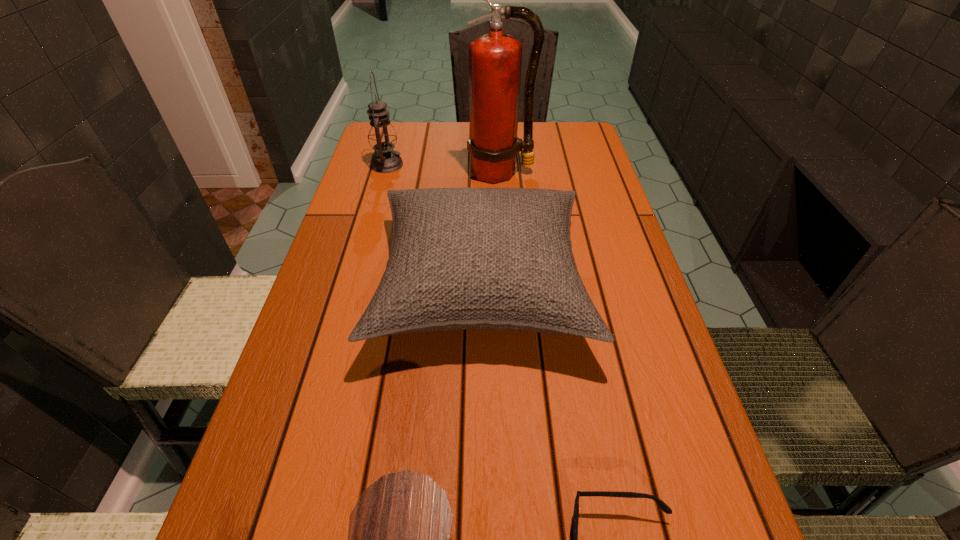
I want to click on fire extinguisher, so click(x=495, y=59).

Where is `oil lamp`? oil lamp is located at coordinates (381, 135).

This screenshot has width=960, height=540. What are the coordinates of `the fourth shortest object` in the screenshot? It's located at (381, 135).

Identify the location of the third farthest object. The image size is (960, 540). (461, 258).

The width and height of the screenshot is (960, 540). Find the location of `free space located 0.050m at the nozzle of the tallest object`. free space located 0.050m at the nozzle of the tallest object is located at coordinates (502, 197).

You are a GUI agent. You are given a task and a screenshot of the screen. Output one action in this format:
    pyautogui.click(x=<x>, y=<y>)
    Task: Click on the free region located 0.090m on the back of the leftmost object
    This screenshot has height=540, width=960.
    Given the screenshot: What is the action you would take?
    pyautogui.click(x=394, y=141)

You are a GUI agent. You are given a task and a screenshot of the screen. Output one action in this format:
    pyautogui.click(x=<x>, y=<y>)
    Task: Click on the vacant region located 0.130m on the front of the third farthest object
    The height and width of the screenshot is (540, 960).
    Given the screenshot: What is the action you would take?
    pyautogui.click(x=482, y=442)

Where is `object present at the far edge`? The width and height of the screenshot is (960, 540). object present at the far edge is located at coordinates (381, 135).

Image resolution: width=960 pixels, height=540 pixels. Identify the location of oil lamp situated at the left edge. (381, 135).

Locate an element on the screen. The width and height of the screenshot is (960, 540). cushion situated at the left edge is located at coordinates [x=461, y=258].